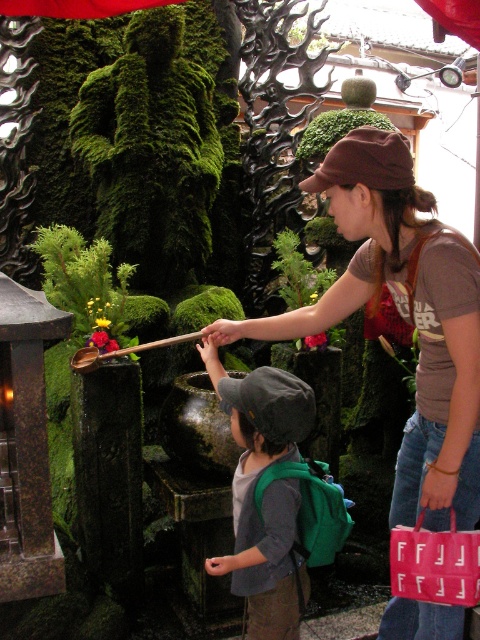
You are standing at point [336,160] and want to walk to point [212,360]. Is the destination point behind you or in front of you?

The destination point [212,360] is behind point [336,160], so it is behind you.

You are a photographer trying to capture a closeup of the brown fabric shirt at center and the gray fabric cap at center. Since you want to focus on both items clearly, which one should you adjust your camera focus to prioritize based on their sizes?

The brown fabric shirt at center has a larger size compared to the gray fabric cap at center, so you should prioritize focusing on the brown fabric shirt at center to ensure both are in clear view.